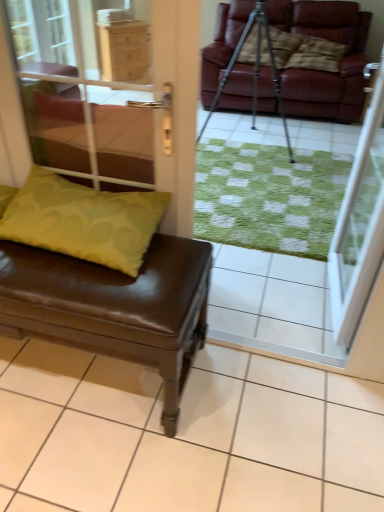
What is the approximate height of metallic tripod at center?

metallic tripod at center is 3.72 feet tall.

Image resolution: width=384 pixels, height=512 pixels. What are the coordinates of `metallic tripod at center` in the screenshot? It's located at (254, 71).

Which point is more distant from viewer, (x=174, y=232) or (x=98, y=192)?

Positioned behind is point (x=174, y=232).

Based on their positions, is green fabric cushion at lower left, the second screen door in the right-to-left sequence, located to the left or right of brown leather bench at lower left?

Based on their positions, green fabric cushion at lower left, the second screen door in the right-to-left sequence, is located to the right of brown leather bench at lower left.

Which of these two, green fabric cushion at lower left, the second screen door in the right-to-left sequence, or brown leather bench at lower left, is wider?

Wider between the two is brown leather bench at lower left.

Image resolution: width=384 pixels, height=512 pixels. I want to click on pillow located on the right of brown leather bench at lower left, so click(x=84, y=220).

From a real-world perspective, between green fabric pillow at left and brown leather bench at lower left, who is vertically higher?

green fabric pillow at left is physically above.

Looking at this image, which object is further away from the camera taking this photo, green fabric pillow at left or brown leather bench at lower left?

Positioned behind is green fabric pillow at left.

From the image's perspective, is green fabric pillow at left over brown leather bench at lower left?

Yes, from the image's perspective, green fabric pillow at left is above brown leather bench at lower left.

What's the angular difference between green fabric pillow at left and metallic tripod at center's facing directions?

4.57 degrees.

You are a GUI agent. You are given a task and a screenshot of the screen. Output one action in this format:
    pyautogui.click(x=<x>, y=<y>)
    Task: Click on the tripod directly beneath the green fabric pillow at left (from a real-world perspective)
    
    Given the screenshot: What is the action you would take?
    pyautogui.click(x=254, y=71)

Is metallic tripod at center a part of green fabric pillow at left?

No, metallic tripod at center is located outside of green fabric pillow at left.

From a real-world perspective, which is physically below, green fabric pillow at left or metallic tripod at center?

metallic tripod at center.

Does point (374, 98) lie in front of point (238, 49)?

Yes, it is in front of point (238, 49).

From a real-world perspective, count 1st screen doors upward from the metallic tripod at center and point to it. Please provide its 2D coordinates.

[(359, 224)]

Which of these two, transparent glass screen door at upper right, arranged as the 1th screen door when viewed from the right, or metallic tripod at center, is wider?

metallic tripod at center.

Who is shorter, metallic tripod at center or transparent glass screen door at upper right, placed as the 2th screen door when sorted from left to right?

Standing shorter between the two is metallic tripod at center.

From the image's perspective, between metallic tripod at center and transparent glass screen door at upper right, arranged as the 1th screen door when viewed from the right, which one is located above?

metallic tripod at center, from the image's perspective.

Considering the relative positions of metallic tripod at center and transparent glass screen door at upper right, placed as the 2th screen door when sorted from left to right, in the image provided, is metallic tripod at center to the left or to the right of transparent glass screen door at upper right, placed as the 2th screen door when sorted from left to right,?

Based on their positions, metallic tripod at center is located to the left of transparent glass screen door at upper right, placed as the 2th screen door when sorted from left to right.

From a real-world perspective, is metallic tripod at center below transparent glass screen door at upper right, placed as the 2th screen door when sorted from left to right?

Yes.

Is green fabric cushion at lower left, positioned as the 1th screen door in left-to-right order, inside the boundaries of green fabric pillow at left, or outside?

green fabric cushion at lower left, positioned as the 1th screen door in left-to-right order, exists outside the volume of green fabric pillow at left.

Between point (186, 176) and point (115, 260), which one is positioned in front?

The point (115, 260) is more forward.

Is green fabric cushion at lower left, positioned as the 1th screen door in left-to-right order, at the right side of green fabric pillow at left?

Correct, you'll find green fabric cushion at lower left, positioned as the 1th screen door in left-to-right order, to the right of green fabric pillow at left.

Based on the photo, which of these two, green fabric cushion at lower left, the second screen door in the right-to-left sequence, or green fabric pillow at left, stands taller?

green fabric cushion at lower left, the second screen door in the right-to-left sequence, is taller.

Is transparent glass screen door at upper right, placed as the 2th screen door when sorted from left to right, positioned with its back to green fabric cushion at lower left, the second screen door in the right-to-left sequence?

transparent glass screen door at upper right, placed as the 2th screen door when sorted from left to right, is not turned away from green fabric cushion at lower left, the second screen door in the right-to-left sequence.

Does point (344, 240) appear closer or farther from the camera than point (80, 150)?

Point (344, 240) appears to be farther away from the viewer than point (80, 150).

Is transparent glass screen door at upper right, placed as the 2th screen door when sorted from left to right, taller than green fabric cushion at lower left, positioned as the 1th screen door in left-to-right order?

Indeed, transparent glass screen door at upper right, placed as the 2th screen door when sorted from left to right, has a greater height compared to green fabric cushion at lower left, positioned as the 1th screen door in left-to-right order.

Image resolution: width=384 pixels, height=512 pixels. In order to click on the 2nd screen door above the brown leather bench at lower left (from the image's perspective) in this screenshot , I will do `click(111, 101)`.

Image resolution: width=384 pixels, height=512 pixels. Identify the location of studio couch in front of the green fabric pillow at left. (107, 284).

Looking at the image, which one is located closer to brown leather bench at lower left, transparent glass screen door at upper right, placed as the 2th screen door when sorted from left to right, or green fabric pillow at left?

green fabric pillow at left is closer to brown leather bench at lower left.

In the scene shown: Estimate the real-world distances between objects in this image. Which object is further from transparent glass screen door at upper right, arranged as the 1th screen door when viewed from the right, brown leather bench at lower left or metallic tripod at center?

Based on the image, metallic tripod at center appears to be further to transparent glass screen door at upper right, arranged as the 1th screen door when viewed from the right.

Looking at the image, which one is located closer to green fabric cushion at lower left, positioned as the 1th screen door in left-to-right order, brown leather bench at lower left or transparent glass screen door at upper right, arranged as the 1th screen door when viewed from the right?

transparent glass screen door at upper right, arranged as the 1th screen door when viewed from the right, is positioned closer to the anchor green fabric cushion at lower left, positioned as the 1th screen door in left-to-right order.

Looking at the image, which one is located closer to brown leather bench at lower left, metallic tripod at center or green fabric pillow at left?

Based on the image, green fabric pillow at left appears to be nearer to brown leather bench at lower left.

From the picture: Which object lies further to the anchor point green fabric pillow at left, transparent glass screen door at upper right, arranged as the 1th screen door when viewed from the right, or metallic tripod at center?

metallic tripod at center is positioned further to the anchor green fabric pillow at left.

Estimate the real-world distances between objects in this image. Which object is closer to transparent glass screen door at upper right, placed as the 2th screen door when sorted from left to right, green fabric cushion at lower left, the second screen door in the right-to-left sequence, or metallic tripod at center?

metallic tripod at center is positioned closer to the anchor transparent glass screen door at upper right, placed as the 2th screen door when sorted from left to right.

Considering their positions, is brown leather bench at lower left positioned further to green fabric cushion at lower left, positioned as the 1th screen door in left-to-right order, than metallic tripod at center?

Among the two, brown leather bench at lower left is located further to green fabric cushion at lower left, positioned as the 1th screen door in left-to-right order.

In the scene shown: When comparing their distances from green fabric cushion at lower left, positioned as the 1th screen door in left-to-right order, does brown leather bench at lower left or green fabric pillow at left seem closer?

green fabric pillow at left is positioned closer to the anchor green fabric cushion at lower left, positioned as the 1th screen door in left-to-right order.

You are a GUI agent. You are given a task and a screenshot of the screen. Output one action in this format:
    pyautogui.click(x=<x>, y=<y>)
    Task: Click on the pillow positioned between brown leather bench at lower left and metallic tripod at center from near to far
    This screenshot has height=512, width=384.
    Given the screenshot: What is the action you would take?
    pyautogui.click(x=84, y=220)

At what (x,y) coordinates should I click in order to perform the action: click on screen door situated between brown leather bench at lower left and transparent glass screen door at upper right, placed as the 2th screen door when sorted from left to right, from left to right. Please return your answer as a coordinate pair (x, y). This screenshot has width=384, height=512. Looking at the image, I should click on (111, 101).

This screenshot has width=384, height=512. What are the coordinates of `pillow between green fabric cushion at lower left, positioned as the 1th screen door in left-to-right order, and metallic tripod at center, along the z-axis` in the screenshot? It's located at (84, 220).

Locate an element on the screen. Image resolution: width=384 pixels, height=512 pixels. screen door situated between green fabric pillow at left and transparent glass screen door at upper right, placed as the 2th screen door when sorted from left to right, from left to right is located at coordinates (111, 101).